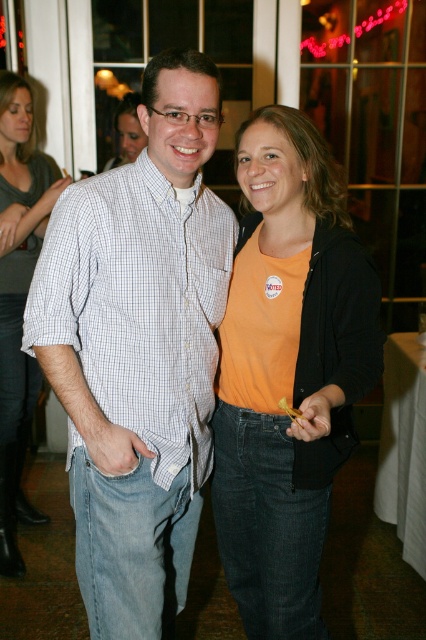
Can you confirm if orange matte shirt at center is thinner than matte orange shirt at center?

Incorrect, orange matte shirt at center's width is not less than matte orange shirt at center's.

Based on the photo, can you confirm if orange matte shirt at center is positioned below matte orange shirt at center?

Correct, orange matte shirt at center is located below matte orange shirt at center.

I want to click on orange matte shirt at center, so click(x=287, y=372).

I want to click on orange matte shirt at center, so click(x=287, y=372).

Between matte gray shirt at upper left and matte orange shirt at center, which one is positioned higher?

matte orange shirt at center

Between matte gray shirt at upper left and matte orange shirt at center, which one is positioned lower?

matte gray shirt at upper left

The width and height of the screenshot is (426, 640). Describe the element at coordinates (19, 300) in the screenshot. I see `matte gray shirt at upper left` at that location.

Identify the location of matte gray shirt at upper left. Image resolution: width=426 pixels, height=640 pixels. (19, 300).

Does white checkered shirt at center appear over matte gray shirt at upper left?

No, white checkered shirt at center is not above matte gray shirt at upper left.

Who is positioned more to the left, white checkered shirt at center or matte gray shirt at upper left?

Positioned to the left is matte gray shirt at upper left.

Is point (172, 243) positioned before point (6, 426)?

Yes, point (172, 243) is closer to viewer.

Find the location of `white checkered shirt at center`. white checkered shirt at center is located at coordinates (138, 349).